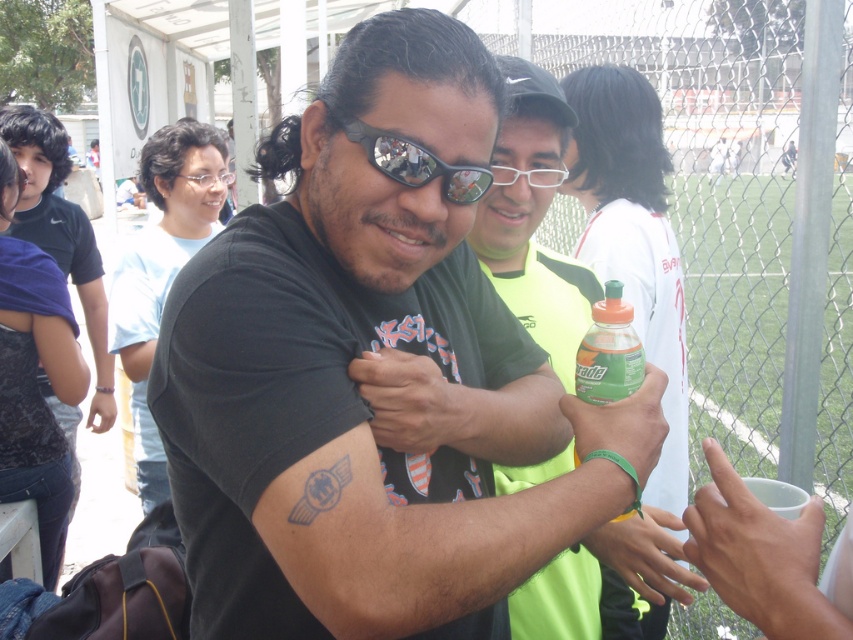
Question: Which object is farther from the camera taking this photo?

Choices:
 (A) matte black goggles at center
 (B) green matte sports jersey at center

Answer: (A)

Question: From the image, what is the correct spatial relationship of black matte t-shirt at center in relation to green matte sports jersey at center?

Choices:
 (A) below
 (B) above

Answer: (B)

Question: Does black matte t-shirt at center have a larger size compared to matte black goggles at center?

Choices:
 (A) yes
 (B) no

Answer: (A)

Question: Which of the following is the farthest from the observer?

Choices:
 (A) (608, 326)
 (B) (229, 172)
 (C) (529, 250)
 (D) (352, 136)

Answer: (B)

Question: Considering the real-world distances, which object is farthest from the green matte bottle at center?

Choices:
 (A) green matte sports jersey at center
 (B) matte black goggles at center

Answer: (B)

Question: Is green matte sports jersey at center wider than green matte bottle at center?

Choices:
 (A) no
 (B) yes

Answer: (B)